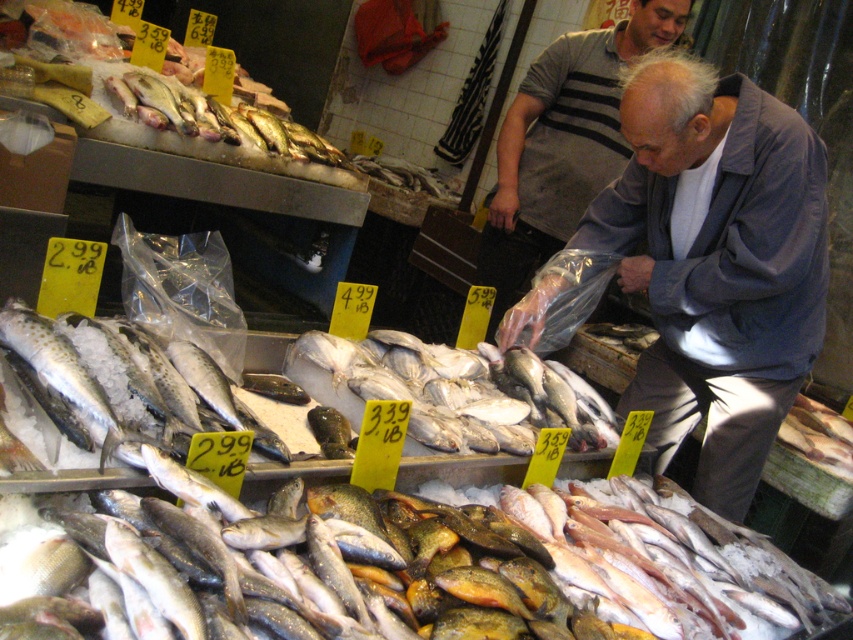
Can you confirm if gray striped shirt at center is positioned to the right of speckled silver fish at center?

Indeed, gray striped shirt at center is positioned on the right side of speckled silver fish at center.

Does gray striped shirt at center have a greater height compared to speckled silver fish at center?

Correct, gray striped shirt at center is much taller as speckled silver fish at center.

I want to click on gray striped shirt at center, so click(561, 144).

Is shiny silver fish at lower center shorter than gray fabric jacket at center?

Indeed, shiny silver fish at lower center has a lesser height compared to gray fabric jacket at center.

Can you confirm if shiny silver fish at lower center is bigger than gray fabric jacket at center?

Yes.

Which is in front, point (378, 579) or point (688, 228)?

Point (378, 579) is more forward.

The image size is (853, 640). In order to click on shiny silver fish at lower center in this screenshot , I will do `click(416, 564)`.

Who is positioned more to the left, shiny silver fish at lower center or shiny silver fish at upper left?

From the viewer's perspective, shiny silver fish at upper left appears more on the left side.

Does point (219, 593) come closer to viewer compared to point (173, 77)?

Yes, point (219, 593) is in front of point (173, 77).

The image size is (853, 640). Identify the location of shiny silver fish at lower center. (416, 564).

Find the location of `shiny silver fish at lower center`. shiny silver fish at lower center is located at coordinates (416, 564).